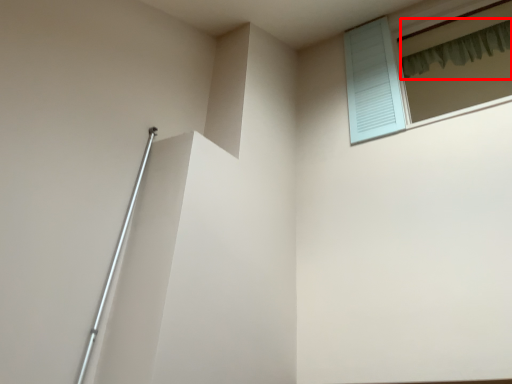
Question: From the image's perspective, what is the correct spatial relationship of shower curtain (annotated by the red box) in relation to window?

Choices:
 (A) above
 (B) below

Answer: (A)